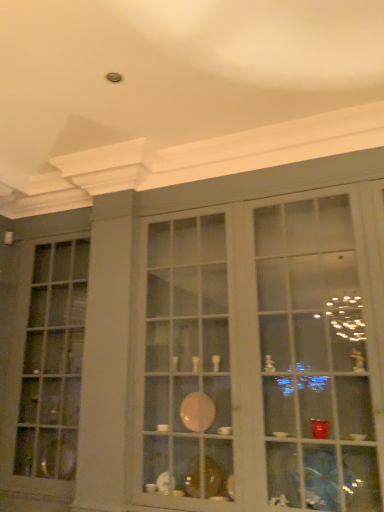
Image resolution: width=384 pixels, height=512 pixels. What are the coordinates of `matte glass window at left` in the screenshot? It's located at (46, 368).

The height and width of the screenshot is (512, 384). Describe the element at coordinates (46, 368) in the screenshot. I see `matte glass window at left` at that location.

Identify the location of matte glass cabinet at center. (262, 355).

This screenshot has width=384, height=512. Describe the element at coordinates (262, 355) in the screenshot. I see `matte glass cabinet at center` at that location.

Identify the location of matte glass window at left. Image resolution: width=384 pixels, height=512 pixels. (46, 368).

Looking at this image, between matte glass window at left and matte glass cabinet at center, which one appears on the left side from the viewer's perspective?

matte glass window at left is more to the left.

Which object is closer to the camera, matte glass window at left or matte glass cabinet at center?

matte glass cabinet at center is closer to the camera.

Which is nearer, (37, 470) or (286, 382)?

The point (286, 382) is closer.

From the image's perspective, does matte glass window at left appear lower than matte glass cabinet at center?

Yes, from the image's perspective, matte glass window at left is below matte glass cabinet at center.

From a real-world perspective, is matte glass window at left under matte glass cabinet at center?

Yes.

Between matte glass window at left and matte glass cabinet at center, which one has smaller width?

matte glass window at left.

Does matte glass window at left have a greater height compared to matte glass cabinet at center?

Correct, matte glass window at left is much taller as matte glass cabinet at center.

Looking at the image, does matte glass window at left seem bigger or smaller compared to matte glass cabinet at center?

Considering their sizes, matte glass window at left takes up less space than matte glass cabinet at center.

Choose the correct answer: Is matte glass window at left inside matte glass cabinet at center or outside it?

matte glass window at left is located beyond the bounds of matte glass cabinet at center.

Does matte glass window at left touch matte glass cabinet at center?

No, matte glass window at left is not next to matte glass cabinet at center.

Based on the photo, is matte glass window at left oriented towards matte glass cabinet at center?

No, matte glass window at left is not turned towards matte glass cabinet at center.

How different are the orientations of matte glass window at left and matte glass cabinet at center in degrees?

There is a 0.306-degree angle between the facing directions of matte glass window at left and matte glass cabinet at center.

In the scene shown: Measure the distance between matte glass window at left and matte glass cabinet at center.

1.31 meters.

Image resolution: width=384 pixels, height=512 pixels. Find the location of `shelf that is in front of the matte glass window at left`. shelf that is in front of the matte glass window at left is located at coordinates (262, 355).

Can you confirm if matte glass cabinet at center is positioned to the left of matte glass window at left?

No, matte glass cabinet at center is not to the left of matte glass window at left.

Relative to matte glass window at left, is matte glass cabinet at center in front or behind?

In the image, matte glass cabinet at center appears in front of matte glass window at left.

Between point (307, 305) and point (35, 337), which one is positioned in front?

The point (307, 305) is more forward.

From the image's perspective, is matte glass cabinet at center located above or below matte glass window at left?

matte glass cabinet at center is situated higher than matte glass window at left in the image.

From a real-world perspective, relative to matte glass window at left, is matte glass cabinet at center vertically above or below?

matte glass cabinet at center is situated higher than matte glass window at left in the real world.

Looking at their sizes, would you say matte glass cabinet at center is wider or thinner than matte glass window at left?

Clearly, matte glass cabinet at center has more width compared to matte glass window at left.

Which of these two, matte glass cabinet at center or matte glass window at left, stands shorter?

With less height is matte glass cabinet at center.

Can you confirm if matte glass cabinet at center is smaller than matte glass window at left?

No, matte glass cabinet at center is not smaller than matte glass window at left.

Would you say matte glass window at left is part of matte glass cabinet at center's contents?

No, matte glass cabinet at center does not contain matte glass window at left.

Is matte glass cabinet at center directly adjacent to matte glass window at left?

No, matte glass cabinet at center is not touching matte glass window at left.

Does matte glass cabinet at center turn towards matte glass window at left?

No, matte glass cabinet at center is not oriented towards matte glass window at left.

What's the angular difference between matte glass cabinet at center and matte glass window at left's facing directions?

The facing directions of matte glass cabinet at center and matte glass window at left are 0.306 degrees apart.

How much distance is there between matte glass cabinet at center and matte glass window at left?

1.31 meters.

Identify the location of shelf above the matte glass window at left (from the image's perspective). This screenshot has height=512, width=384. (262, 355).

In order to click on shelf on the right of matte glass window at left in this screenshot , I will do `click(262, 355)`.

Locate an element on the screen. The height and width of the screenshot is (512, 384). window below the matte glass cabinet at center (from the image's perspective) is located at coordinates (46, 368).